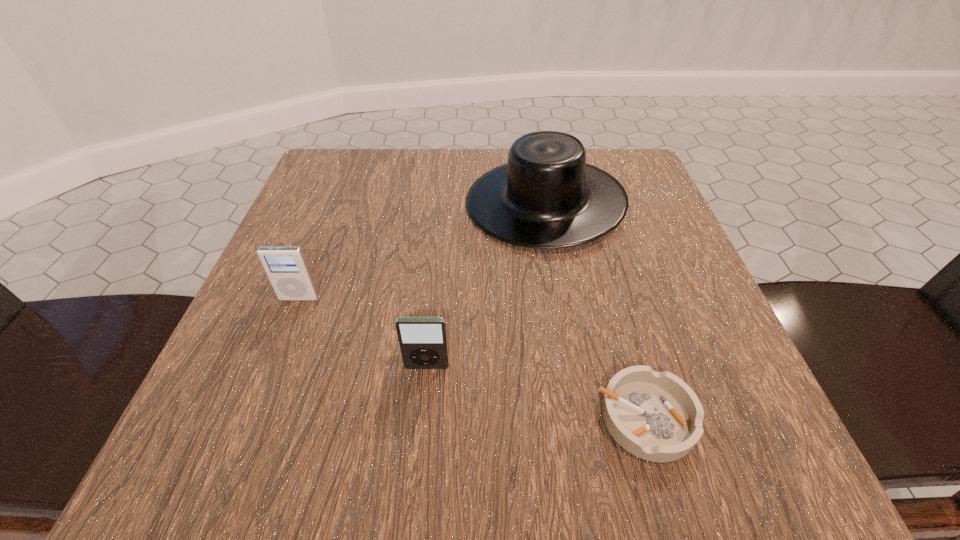
This screenshot has height=540, width=960. What are the coordinates of `dress hat` in the screenshot? It's located at (546, 196).

Find the location of a particular element. Image resolution: width=960 pixels, height=540 pixels. the farthest object is located at coordinates point(546,196).

Where is `the second farthest object`? The image size is (960, 540). the second farthest object is located at coordinates (285, 266).

Where is `the leftmost object`? Image resolution: width=960 pixels, height=540 pixels. the leftmost object is located at coordinates click(285, 266).

Locate an element on the screen. the second nearest object is located at coordinates (423, 343).

In order to click on the third object from right to left in this screenshot , I will do `click(423, 343)`.

What are the coordinates of `the nearest object` in the screenshot? It's located at (656, 416).

Identify the location of the shortest object. Image resolution: width=960 pixels, height=540 pixels. (656, 416).

Find the location of a particular element. The image size is (960, 540). blank space located on the left of the tallest object is located at coordinates click(422, 202).

Locate an element on the screen. blank space located 0.280m on the front-facing side of the second farthest object is located at coordinates (228, 478).